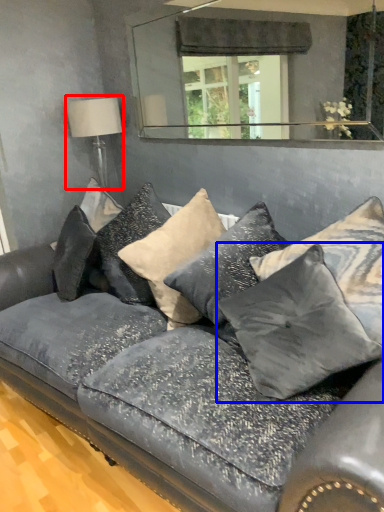
Question: Which object is closer to the camera taking this photo, table lamp (highlighted by a red box) or pillow (highlighted by a blue box)?

Choices:
 (A) table lamp
 (B) pillow

Answer: (B)